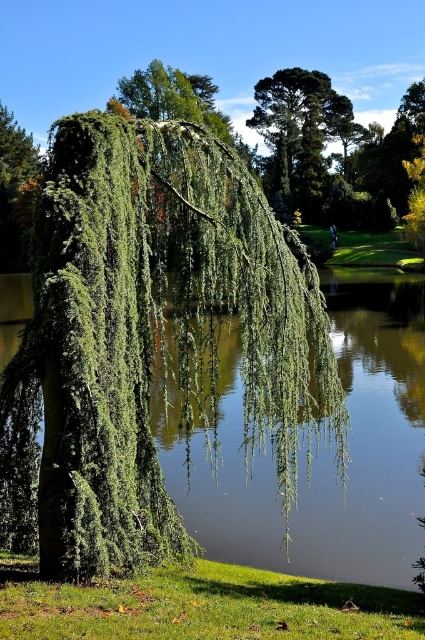
Between green grass at lower left and green leafy tree at upper center, which one has less height?

green grass at lower left is shorter.

Is green grass at lower left thinner than green leafy tree at upper center?

Yes.

Between point (175, 595) and point (277, 90), which one is positioned behind?

Point (277, 90)

Image resolution: width=425 pixels, height=640 pixels. I want to click on green grass at lower left, so tap(203, 605).

Between point (170, 148) and point (291, 93), which one is positioned in front?

Point (170, 148)

From the picture: Which of these two, green leafy willow at center or green leafy tree at upper center, stands taller?

green leafy tree at upper center

Between point (108, 376) and point (325, 132), which one is positioned behind?

Positioned behind is point (325, 132).

Find the location of a particular element. This screenshot has height=640, width=425. green leafy willow at center is located at coordinates (149, 339).

From the picture: Can you confirm if green leafy willow at center is taller than green grass at lower left?

Yes.

Does green leafy willow at center appear on the left side of green grass at lower left?

Indeed, green leafy willow at center is positioned on the left side of green grass at lower left.

Does point (272, 380) come closer to viewer compared to point (393, 628)?

No.

Locate an element on the screen. green leafy willow at center is located at coordinates (149, 339).